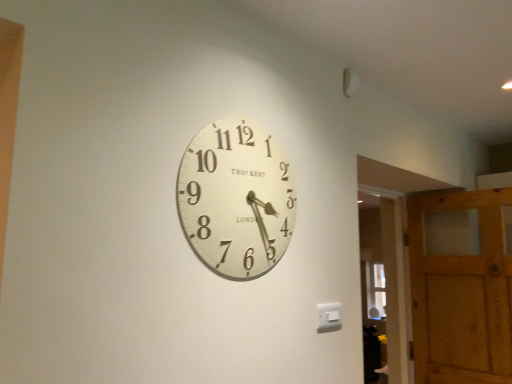
Question: Does white matte clock at center appear on the right side of transparent glass door at right?

Choices:
 (A) yes
 (B) no

Answer: (B)

Question: Is white matte clock at center bigger than transparent glass door at right?

Choices:
 (A) yes
 (B) no

Answer: (B)

Question: Could you tell me if white matte clock at center is facing transparent glass door at right?

Choices:
 (A) yes
 (B) no

Answer: (B)

Question: From the image's perspective, does white matte clock at center appear lower than transparent glass door at right?

Choices:
 (A) yes
 (B) no

Answer: (B)

Question: Does white matte clock at center have a lesser height compared to transparent glass door at right?

Choices:
 (A) no
 (B) yes

Answer: (B)

Question: Based on their positions, is transparent glass door at right located to the left or right of white matte clock at center?

Choices:
 (A) left
 (B) right

Answer: (B)

Question: Looking at the image, does transparent glass door at right seem bigger or smaller compared to white matte clock at center?

Choices:
 (A) big
 (B) small

Answer: (A)

Question: In terms of width, does transparent glass door at right look wider or thinner when compared to white matte clock at center?

Choices:
 (A) thin
 (B) wide

Answer: (B)

Question: From a real-world perspective, is transparent glass door at right above or below white matte clock at center?

Choices:
 (A) below
 (B) above

Answer: (A)

Question: Relative to wooden barn door at right, is transparent glass door at right in front or behind?

Choices:
 (A) front
 (B) behind

Answer: (B)

Question: Is transparent glass door at right to the left or to the right of wooden barn door at right in the image?

Choices:
 (A) right
 (B) left

Answer: (B)

Question: Considering the positions of transparent glass door at right and wooden barn door at right in the image, is transparent glass door at right taller or shorter than wooden barn door at right?

Choices:
 (A) short
 (B) tall

Answer: (B)

Question: Considering the positions of transparent glass door at right and wooden barn door at right in the image, is transparent glass door at right wider or thinner than wooden barn door at right?

Choices:
 (A) wide
 (B) thin

Answer: (B)

Question: Is wooden barn door at right bigger or smaller than white matte clock at center?

Choices:
 (A) big
 (B) small

Answer: (A)

Question: In the image, is wooden barn door at right on the left side or the right side of white matte clock at center?

Choices:
 (A) left
 (B) right

Answer: (B)